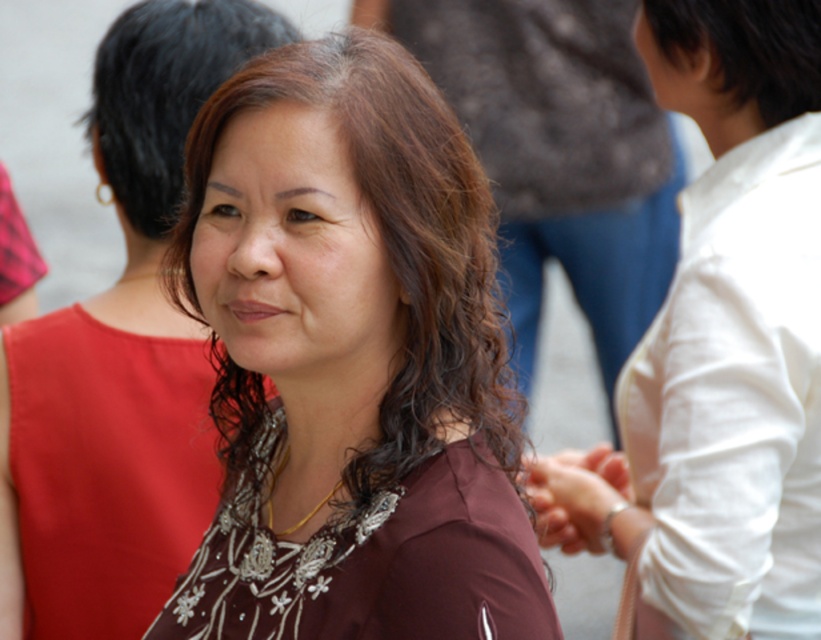
Question: Considering the real-world distances, which object is closest to the satin red dress at center?

Choices:
 (A) brown shiny hair at center
 (B) white cotton shirt at right
 (C) matte brown hair at center
 (D) brown wavy hair at center

Answer: (C)

Question: Can you confirm if satin red dress at center is positioned to the right of beaded fabric dress at center?

Choices:
 (A) yes
 (B) no

Answer: (B)

Question: Considering the real-world distances, which object is farthest from the matte brown hair at center?

Choices:
 (A) brown wavy hair at center
 (B) white cotton shirt at right
 (C) satin red dress at center
 (D) dark brown hair at upper right

Answer: (D)

Question: Is white cotton shirt at right behind satin red dress at center?

Choices:
 (A) no
 (B) yes

Answer: (A)

Question: Which is farther from the beaded fabric dress at center?

Choices:
 (A) brown wavy hair at center
 (B) satin red dress at center
 (C) white cotton shirt at right
 (D) brown shiny hair at center

Answer: (D)

Question: Can you confirm if brown wavy hair at center is wider than beaded fabric dress at center?

Choices:
 (A) no
 (B) yes

Answer: (A)